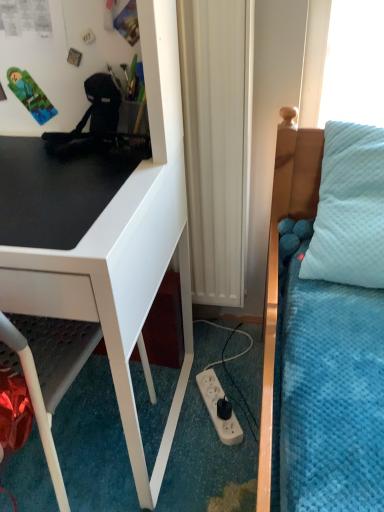
From the picture: Measure the distance between point (220, 272) and camera.

4.23 feet.

Measure the distance between white glossy desk at left and camera.

white glossy desk at left and camera are 22.73 inches apart from each other.

This screenshot has width=384, height=512. What are the coordinates of `white matte radiator at center` in the screenshot? It's located at (217, 142).

Do you think white glossy desk at left is within black matte desk at left, or outside of it?

white glossy desk at left exists outside the volume of black matte desk at left.

Does white glossy desk at left have a lesser height compared to black matte desk at left?

In fact, white glossy desk at left may be taller than black matte desk at left.

Locate an element on the screen. This screenshot has width=384, height=512. table top that appears above the white glossy desk at left (from the image's perspective) is located at coordinates (60, 187).

Is white glossy desk at left facing away from black matte desk at left?

No.

Is white plastic power outlet at lower center not near white glossy desk at left?

They are positioned close to each other.

Does white plastic power outlet at lower center appear on the right side of white glossy desk at left?

Yes, white plastic power outlet at lower center is to the right of white glossy desk at left.

Is white plastic power outlet at lower center oriented towards white glossy desk at left?

No, white plastic power outlet at lower center is not aimed at white glossy desk at left.

From the image's perspective, between white plastic power outlet at lower center and white glossy desk at left, which one is located above?

white glossy desk at left is shown above in the image.

From a real-world perspective, is black matte desk at left physically below white matte radiator at center?

No.

Considering the sizes of objects black matte desk at left and white matte radiator at center in the image provided, who is wider, black matte desk at left or white matte radiator at center?

Wider between the two is black matte desk at left.

Which of these two, black matte desk at left or white matte radiator at center, stands taller?

white matte radiator at center is taller.

How distant is black matte desk at left from white matte radiator at center?

The distance of black matte desk at left from white matte radiator at center is 13.64 inches.

Locate an element on the screen. curtain that appears on the right of white glossy desk at left is located at coordinates (217, 142).

From a real-world perspective, is white matte radiator at center above or below white glossy desk at left?

Clearly, from a real-world perspective, white matte radiator at center is above white glossy desk at left.

Is white matte radiator at center not close to white glossy desk at left?

No, white matte radiator at center is not far away from white glossy desk at left.

Is the surface of white glossy desk at left in direct contact with white plastic power outlet at lower center?

No, white glossy desk at left is not in contact with white plastic power outlet at lower center.

From the image's perspective, between white glossy desk at left and white plastic power outlet at lower center, which one is located above?

white glossy desk at left, from the image's perspective.

Consider the image. Is white glossy desk at left looking in the opposite direction of white plastic power outlet at lower center?

No, white glossy desk at left is not facing away from white plastic power outlet at lower center.

Considering the sizes of white plastic power outlet at lower center and white matte radiator at center in the image, is white plastic power outlet at lower center wider or thinner than white matte radiator at center?

white plastic power outlet at lower center is wider than white matte radiator at center.

From the image's perspective, between white plastic power outlet at lower center and white matte radiator at center, who is located below?

white plastic power outlet at lower center, from the image's perspective.

Measure the distance between white plastic power outlet at lower center and white matte radiator at center.

white plastic power outlet at lower center and white matte radiator at center are 21.94 inches apart.

Does white plastic power outlet at lower center appear on the right side of white matte radiator at center?

Yes, white plastic power outlet at lower center is to the right of white matte radiator at center.

How different are the orientations of white matte radiator at center and black matte desk at left in degrees?

The angle between the facing direction of white matte radiator at center and the facing direction of black matte desk at left is 1.22 degrees.

From the picture: Is white matte radiator at center oriented away from black matte desk at left?

white matte radiator at center does not have its back to black matte desk at left.

From the picture: Considering the positions of objects white matte radiator at center and black matte desk at left in the image provided, who is behind, white matte radiator at center or black matte desk at left?

white matte radiator at center is behind.

Which of these two, white matte radiator at center or black matte desk at left, is thinner?

Thinner between the two is white matte radiator at center.

Image resolution: width=384 pixels, height=512 pixels. Find the location of `table top that is behind the white glossy desk at left`. table top that is behind the white glossy desk at left is located at coordinates (60, 187).

Find the location of a particular element. The height and width of the screenshot is (512, 384). desk lying in front of the white plastic power outlet at lower center is located at coordinates (98, 263).

From the image, which object appears to be farther from black matte desk at left, white plastic power outlet at lower center or white matte radiator at center?

The object further to black matte desk at left is white plastic power outlet at lower center.

From the image, which object appears to be farther from white plastic power outlet at lower center, white glossy desk at left or white matte radiator at center?

white matte radiator at center.

Which object lies further to the anchor point white plastic power outlet at lower center, white matte radiator at center or black matte desk at left?

black matte desk at left is positioned further to the anchor white plastic power outlet at lower center.

Looking at the image, which one is located closer to white matte radiator at center, white plastic power outlet at lower center or black matte desk at left?

Based on the image, black matte desk at left appears to be nearer to white matte radiator at center.

Which object lies further to the anchor point white matte radiator at center, white plastic power outlet at lower center or white glossy desk at left?

white plastic power outlet at lower center lies further to white matte radiator at center than the other object.

Based on the photo, considering their positions, is black matte desk at left positioned closer to white plastic power outlet at lower center than white glossy desk at left?

The object closer to white plastic power outlet at lower center is white glossy desk at left.

When comparing their distances from white matte radiator at center, does white glossy desk at left or white plastic power outlet at lower center seem closer?

Among the two, white glossy desk at left is located nearer to white matte radiator at center.

Looking at the image, which one is located closer to white matte radiator at center, white glossy desk at left or black matte desk at left?

white glossy desk at left is positioned closer to the anchor white matte radiator at center.

Where is `table top between white matte radiator at center and white plastic power outlet at lower center from top to bottom`? The height and width of the screenshot is (512, 384). table top between white matte radiator at center and white plastic power outlet at lower center from top to bottom is located at coordinates (60, 187).

Where is `curtain positioned between white glossy desk at left and white plastic power outlet at lower center from near to far`? This screenshot has height=512, width=384. curtain positioned between white glossy desk at left and white plastic power outlet at lower center from near to far is located at coordinates (217, 142).

Image resolution: width=384 pixels, height=512 pixels. Find the location of `table top between white glossy desk at left and white matte radiator at center`. table top between white glossy desk at left and white matte radiator at center is located at coordinates (60, 187).

Where is `table top between white glossy desk at left and white plastic power outlet at lower center from front to back`? Image resolution: width=384 pixels, height=512 pixels. table top between white glossy desk at left and white plastic power outlet at lower center from front to back is located at coordinates (60, 187).